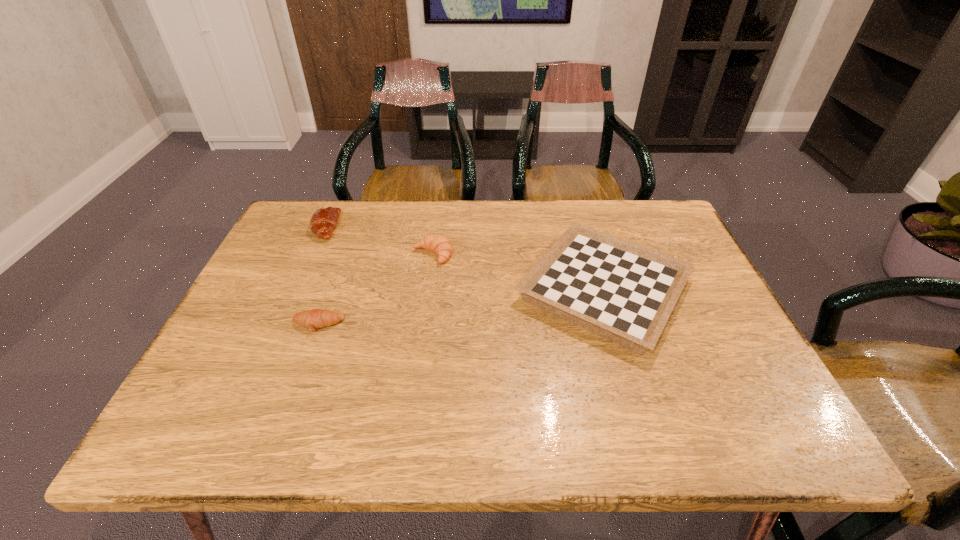
This screenshot has height=540, width=960. In order to click on the second object from right to left in this screenshot , I will do `click(440, 245)`.

Where is `checkerboard`? The height and width of the screenshot is (540, 960). checkerboard is located at coordinates (624, 292).

Where is `the shortest crescent roll`? the shortest crescent roll is located at coordinates (313, 319).

The height and width of the screenshot is (540, 960). Find the location of `the shortest object`. the shortest object is located at coordinates (313, 319).

Locate an element on the screen. free region located on the front of the second object from right to left is located at coordinates (427, 299).

What are the coordinates of `vacant space located 0.240m on the left of the checkerboard` in the screenshot? It's located at (417, 289).

Find the location of a particular element. This screenshot has width=960, height=540. blank space located 0.060m on the right of the shortest object is located at coordinates (370, 325).

Locate an element on the screen. This screenshot has height=540, width=960. checkerboard present at the far edge is located at coordinates (624, 292).

Locate an element on the screen. The width and height of the screenshot is (960, 540). object situated at the right edge is located at coordinates (624, 292).

Find the location of a particular element. The width and height of the screenshot is (960, 540). object present at the far left corner is located at coordinates 324,220.